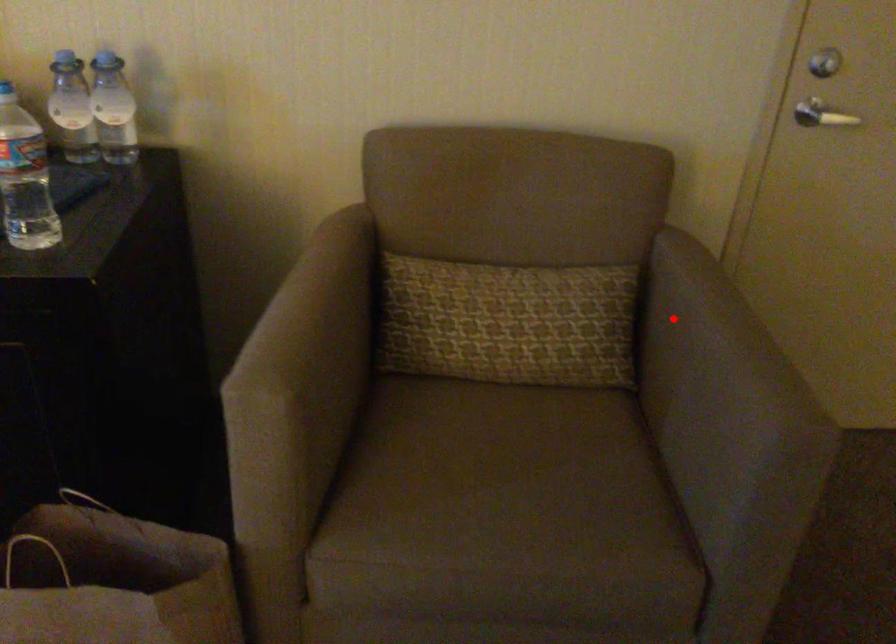
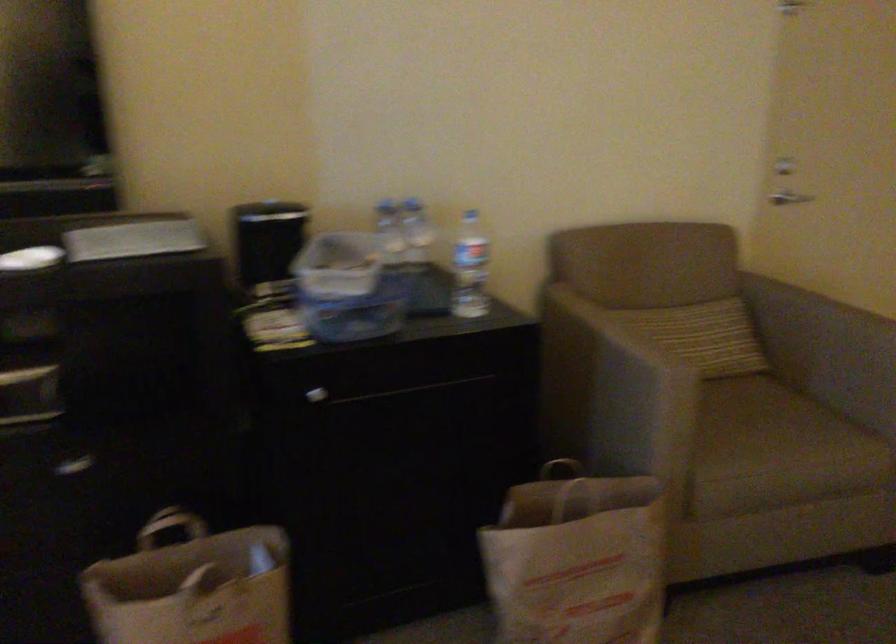
Question: I am providing you with two images of the same scene from different viewpoints. Given a red point in image1, look at the same physical point in image2. Is it:

Choices:
 (A) Closer to the viewpoint
 (B) Farther from the viewpoint

Answer: (B)